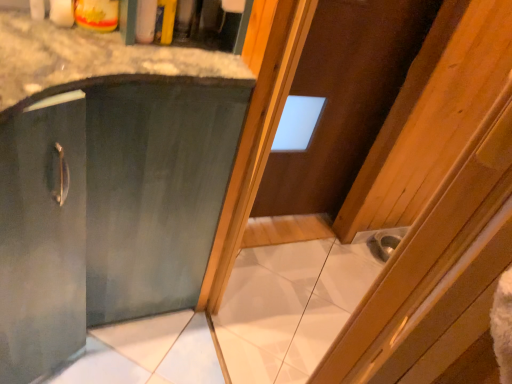
Question: From their relative heights in the image, would you say brown wooden door at upper center is taller or shorter than matte green cabinet at center?

Choices:
 (A) tall
 (B) short

Answer: (A)

Question: Considering the positions of point (274, 183) and point (145, 188), is point (274, 183) closer or farther from the camera than point (145, 188)?

Choices:
 (A) closer
 (B) farther

Answer: (B)

Question: Estimate the real-world distances between objects in this image. Which object is closer to the metallic silver sink at lower right?

Choices:
 (A) brown wooden door at upper center
 (B) matte green cabinet at center

Answer: (A)

Question: Which object is the farthest from the metallic silver sink at lower right?

Choices:
 (A) brown wooden door at upper center
 (B) matte green cabinet at center

Answer: (B)